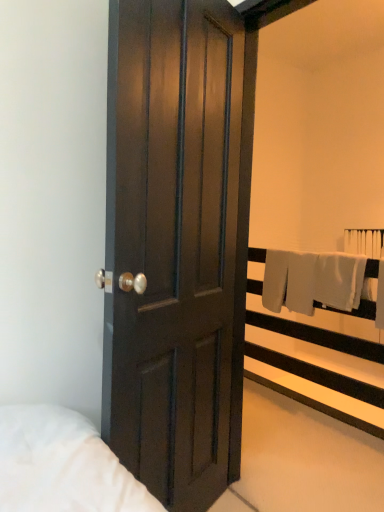
Question: Is dark wood door at center situated inside white fabric at upper right or outside?

Choices:
 (A) outside
 (B) inside

Answer: (A)

Question: Based on their sizes in the image, would you say dark wood door at center is bigger or smaller than white fabric at upper right?

Choices:
 (A) small
 (B) big

Answer: (A)

Question: Is dark wood door at center in front of or behind white fabric at upper right in the image?

Choices:
 (A) front
 (B) behind

Answer: (A)

Question: Do you think white fabric at upper right is within dark wood door at center, or outside of it?

Choices:
 (A) inside
 (B) outside

Answer: (B)

Question: From a real-world perspective, is white fabric at upper right above or below dark wood door at center?

Choices:
 (A) below
 (B) above

Answer: (A)

Question: Is white fabric at upper right in front of or behind dark wood door at center in the image?

Choices:
 (A) behind
 (B) front

Answer: (A)

Question: In the image, is white fabric at upper right on the left side or the right side of dark wood door at center?

Choices:
 (A) right
 (B) left

Answer: (A)